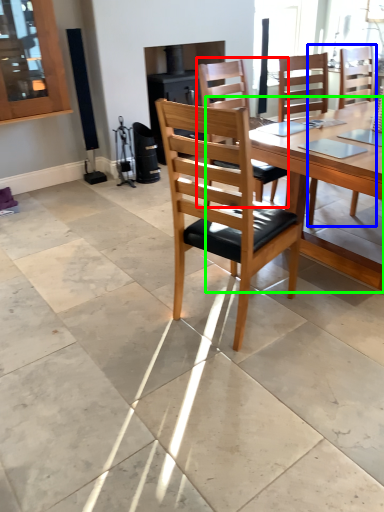
Question: Which is nearer to the chair (highlighted by a red box)? chair (highlighted by a blue box) or round table (highlighted by a green box).

Choices:
 (A) chair
 (B) round table

Answer: (B)